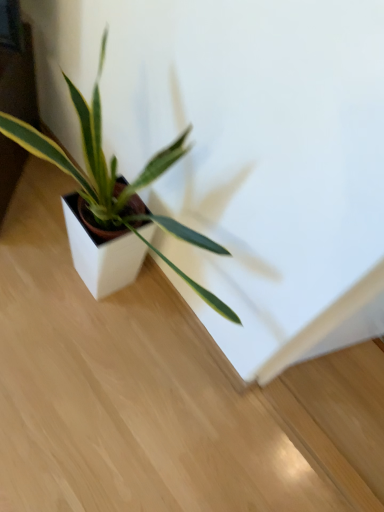
Locate an element on the screen. vacant space to the right of green matte plant at center-left is located at coordinates (215, 414).